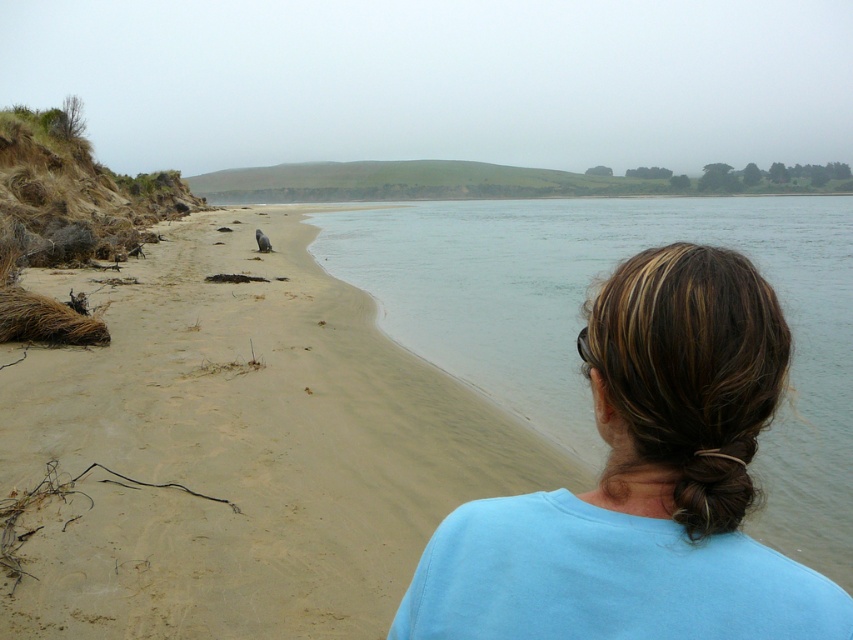
You are a photographer standing at the sandy beach at lower left, aiming to capture a closeup shot of the blue fabric hair at center. Given that your camera has a maximum focus range of 5 meters, will you be able to take the photo without moving closer?

The distance between the sandy beach at lower left and the blue fabric hair at center is 4.81 meters, which is within the camera maximum focus range of 5 meters. Therefore, you can take the photo without moving closer.

You are standing on the beach and see two points marked in the image. The first point is at coordinates point (152,554) and the second point is at point (680,284). Which point is closer to you?

Point (152,554) is closer to you because it is further to the camera than point (680,284).

You are a photographer trying to capture the blue fabric hair at center and the sandy beach at lower left in the same frame. Which object is closer to the camera?

The sandy beach at lower left is closer to the camera because the blue fabric hair at center is behind it.